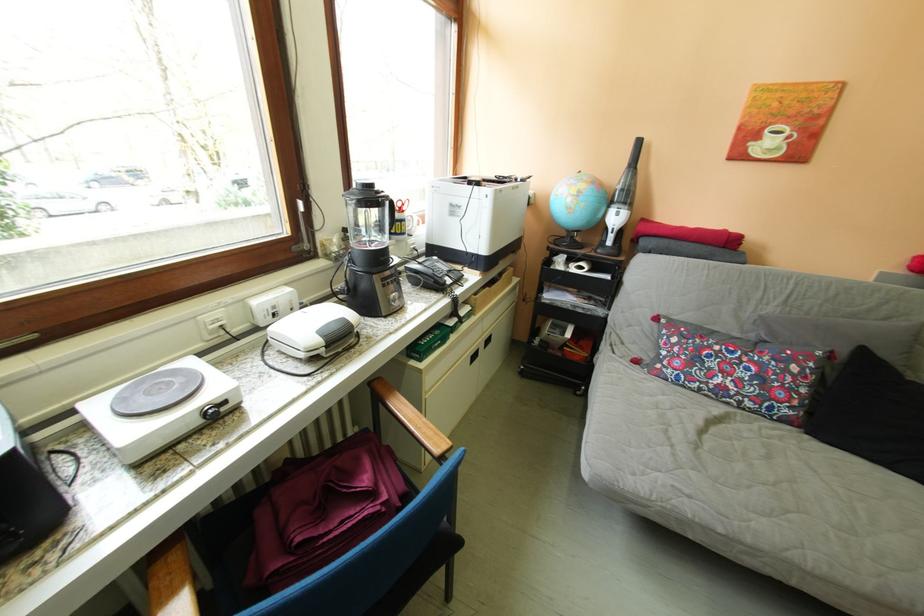
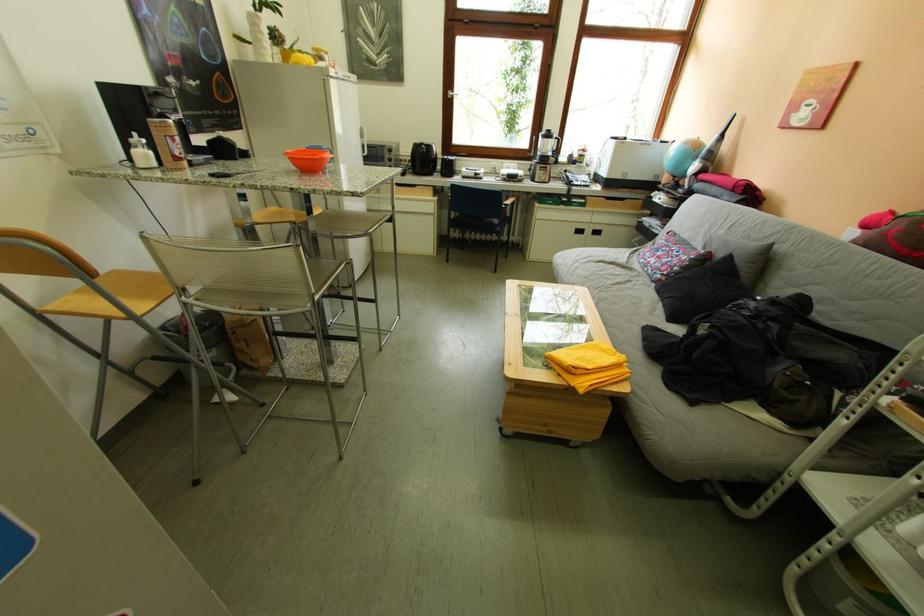
The point at (307, 252) is marked in the first image. Where is the corresponding point in the second image?

(541, 156)